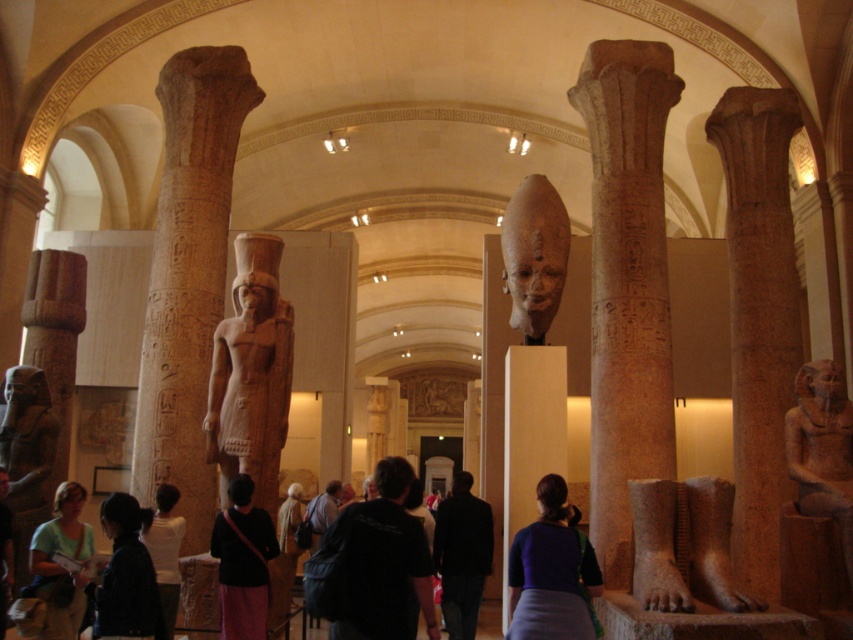
Question: Is white marble statue at center to the left of dark blue shirt at lower left from the viewer's perspective?

Choices:
 (A) no
 (B) yes

Answer: (A)

Question: Considering the relative positions of purple fabric bag at center and black fabric backpack at center in the image provided, where is purple fabric bag at center located with respect to black fabric backpack at center?

Choices:
 (A) below
 (B) above

Answer: (B)

Question: Which of the following is the farthest from the observer?

Choices:
 (A) (379, 474)
 (B) (842, 513)

Answer: (B)

Question: Which point appears farthest from the camera in this image?

Choices:
 (A) (1, 547)
 (B) (474, 518)
 (C) (62, 627)

Answer: (B)

Question: Based on their relative distances, which object is farther from the black fabric backpack at center?

Choices:
 (A) black fabric at center
 (B) polished sandstone statue at right
 (C) dark blue shirt at center

Answer: (B)

Question: Considering the relative positions of purple fabric bag at center and light green fabric shirt at lower left in the image provided, where is purple fabric bag at center located with respect to light green fabric shirt at lower left?

Choices:
 (A) right
 (B) left

Answer: (A)